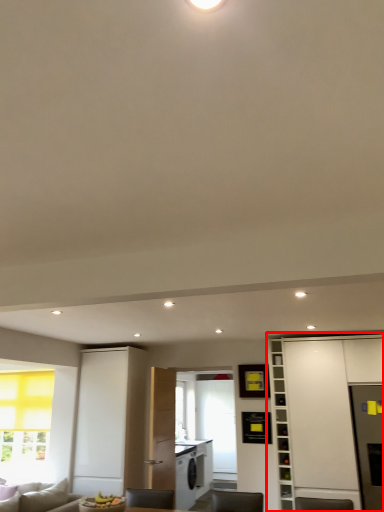
Question: From the image's perspective, where is cabinetry (annotated by the red box) located in relation to bookshelf in the image?

Choices:
 (A) below
 (B) above

Answer: (B)